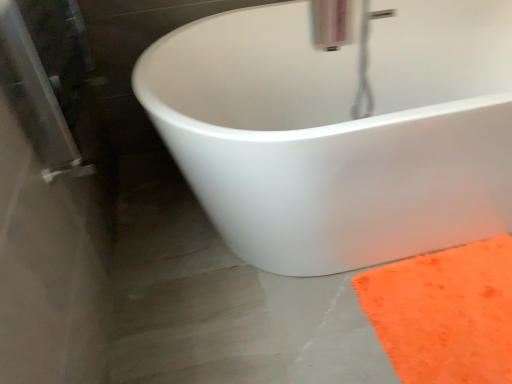
Image resolution: width=512 pixels, height=384 pixels. Identify the location of blank space situated above orange fuzzy rug at lower right (from a real-world perspective). (455, 304).